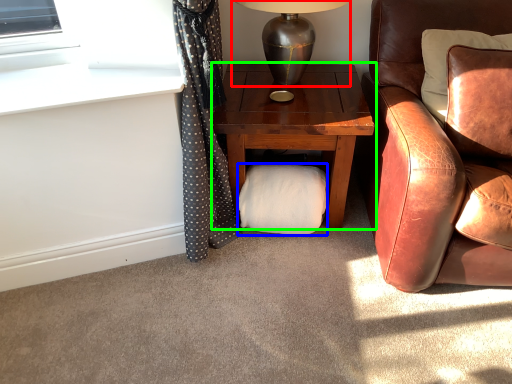
Question: Based on their relative distances, which object is nearer to table lamp (highlighted by a red box)? Choose from material (highlighted by a blue box) and nightstand (highlighted by a green box).

Choices:
 (A) material
 (B) nightstand

Answer: (B)